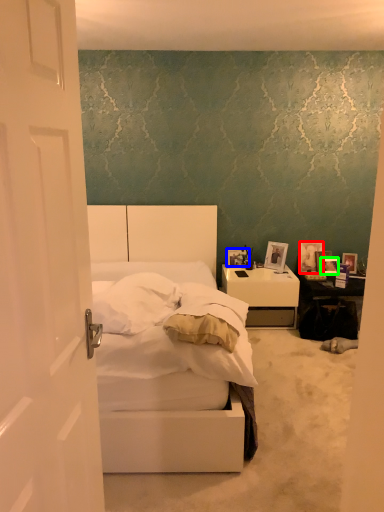
Question: Based on their relative distances, which object is nearer to picture frame (highlighted by a red box)? Choose from picture frame (highlighted by a blue box) and picture frame (highlighted by a green box).

Choices:
 (A) picture frame
 (B) picture frame

Answer: (B)